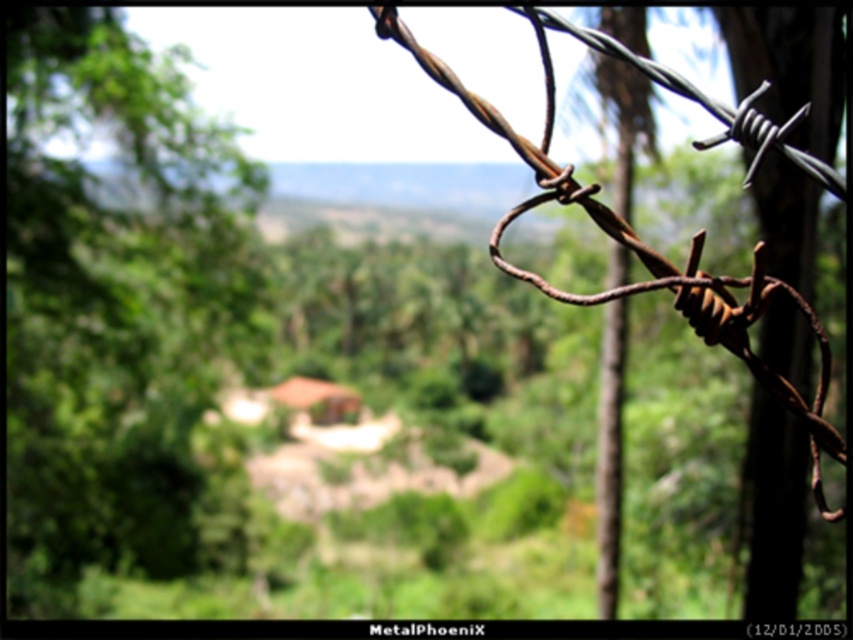
Question: Which object is closer to the camera taking this photo?

Choices:
 (A) green leafy tree at left
 (B) rusty wire at right

Answer: (B)

Question: Is green leafy tree at left behind rusty wire at right?

Choices:
 (A) yes
 (B) no

Answer: (A)

Question: Which of the following is the farthest from the observer?

Choices:
 (A) (125, 486)
 (B) (527, 19)

Answer: (A)

Question: Is green leafy tree at left bigger than rusty wire at right?

Choices:
 (A) no
 (B) yes

Answer: (A)

Question: From the image, what is the correct spatial relationship of green leafy tree at left in relation to rusty wire at right?

Choices:
 (A) above
 (B) below

Answer: (A)